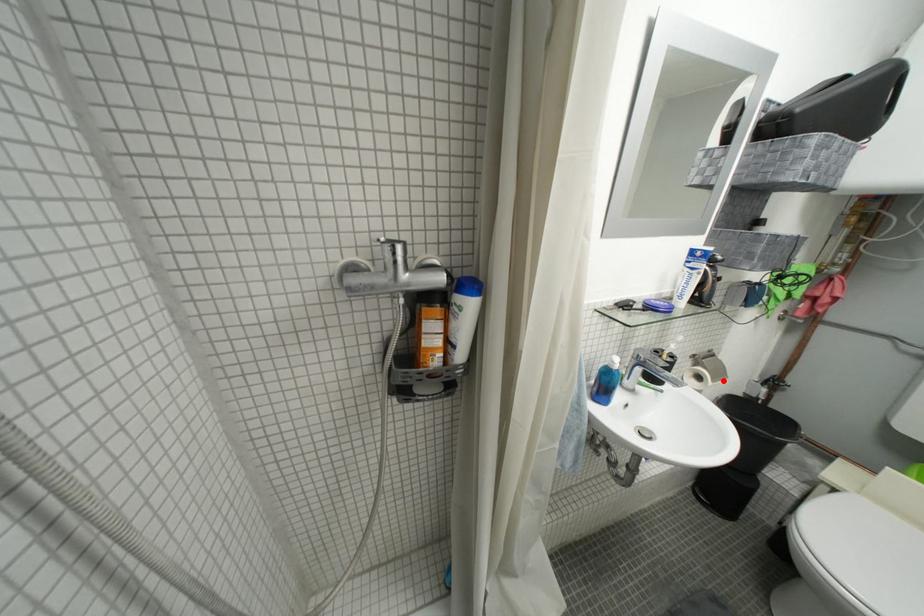
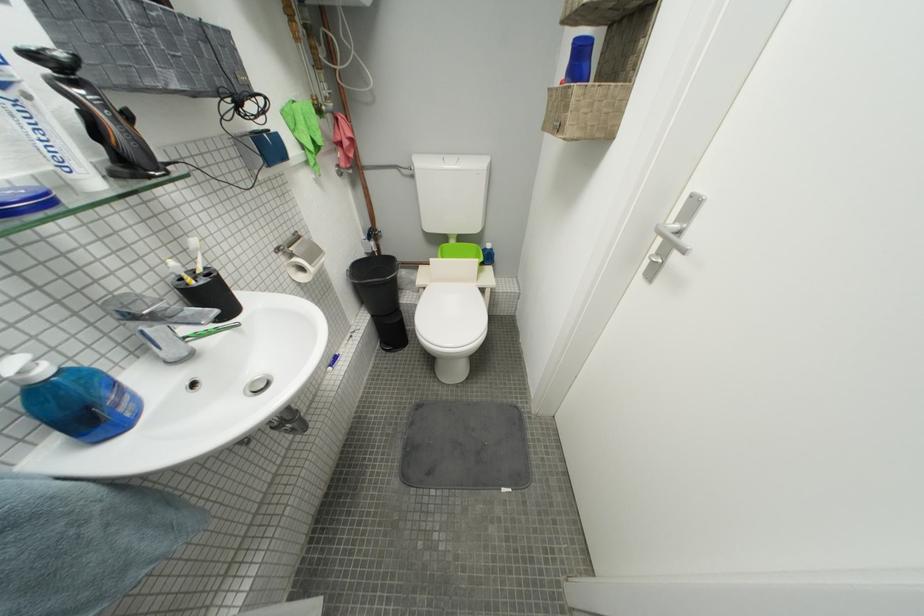
Where in the second image is the point corresponding to the highlighted location from the first image?

(320, 265)